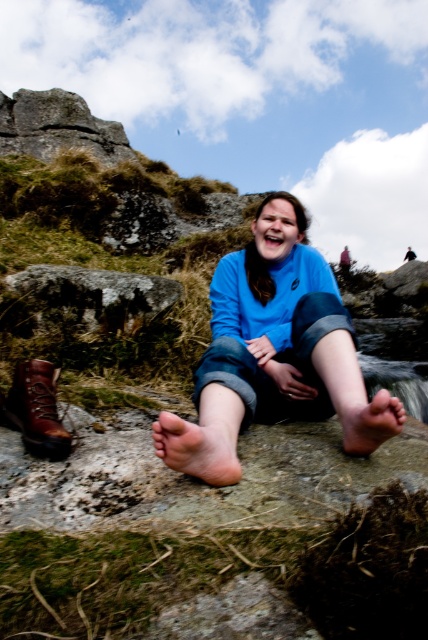
You are standing in front of the image and want to touch the two points labeled as point [359,433] and point [45,394]. Which point would require you to reach further forward to touch it?

Point [45,394] requires reaching further forward because it is farther from the viewer compared to point [359,433], which is closer.